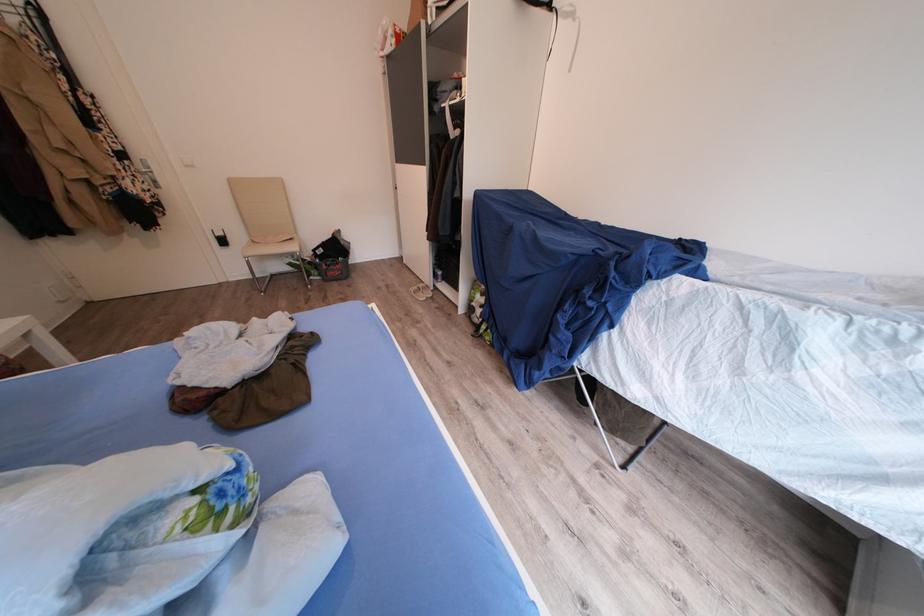
This screenshot has width=924, height=616. Describe the element at coordinates (332, 257) in the screenshot. I see `the black plastic crate` at that location.